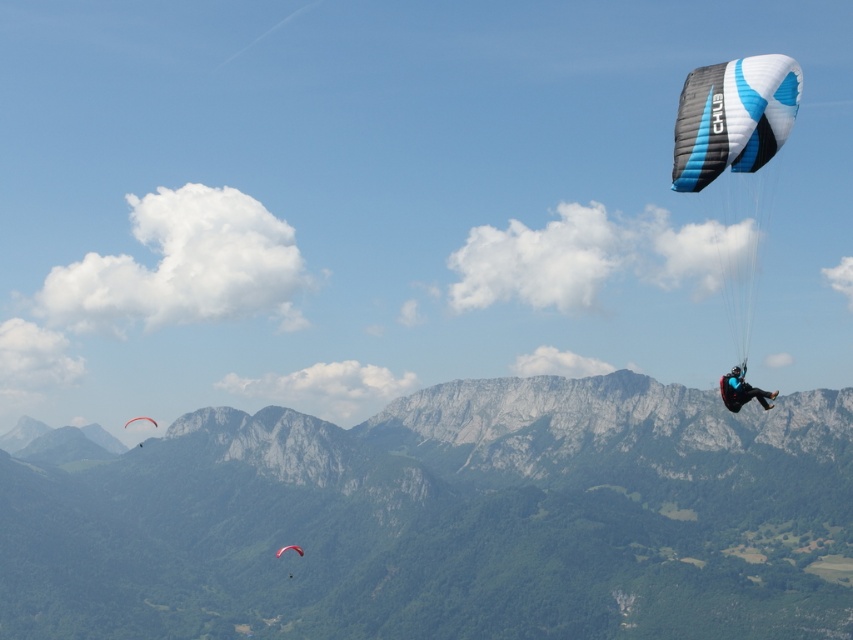
Is point (735, 166) farther from camera compared to point (296, 550)?

No.

Which is in front, point (764, 77) or point (286, 547)?

Point (764, 77) is more forward.

Identify the location of blue/white fabric parachute at right. (732, 116).

This screenshot has height=640, width=853. Describe the element at coordinates (444, 518) in the screenshot. I see `green textured mountain at center` at that location.

Is point (659, 406) more distant than point (694, 170)?

Yes, it is behind point (694, 170).

Is point (227, 540) positioned behind point (762, 64)?

Yes, it is.

Image resolution: width=853 pixels, height=640 pixels. Find the location of `green textured mountain at center`. green textured mountain at center is located at coordinates (444, 518).

Is matte blue parachute at upper right smaller than matte black parachute at lower left?

Actually, matte blue parachute at upper right might be larger than matte black parachute at lower left.

Between matte blue parachute at upper right and matte black parachute at lower left, which one is positioned higher?

matte blue parachute at upper right is above.

Image resolution: width=853 pixels, height=640 pixels. I want to click on matte blue parachute at upper right, so click(741, 390).

Where is `matte blue parachute at upper right`? This screenshot has height=640, width=853. matte blue parachute at upper right is located at coordinates (741, 390).